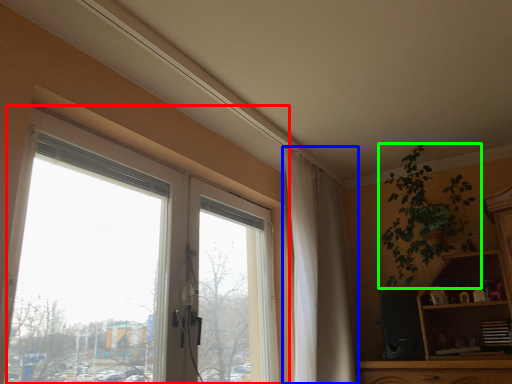
Question: Estimate the real-world distances between objects in this image. Which object is closer to window (highlighted by a red box), curtain (highlighted by a blue box) or houseplant (highlighted by a green box)?

Choices:
 (A) curtain
 (B) houseplant

Answer: (A)